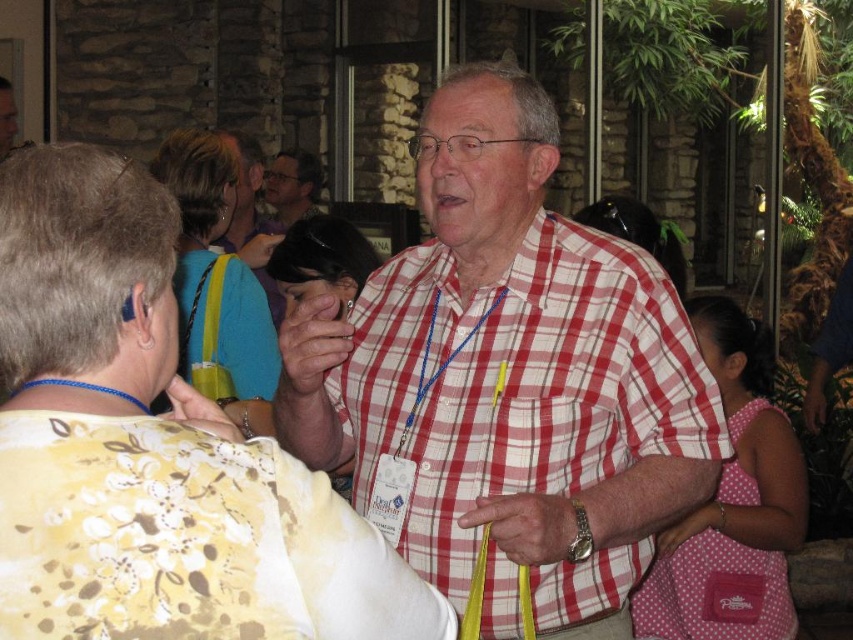
Question: Is red checkered shirt at center to the right of matte yellow lanyard at upper center from the viewer's perspective?

Choices:
 (A) no
 (B) yes

Answer: (B)

Question: Which of the following is the farthest from the observer?

Choices:
 (A) (265, 173)
 (B) (260, 236)

Answer: (A)

Question: Does red checkered shirt at center lie in front of matte black glasses at upper center?

Choices:
 (A) no
 (B) yes

Answer: (B)

Question: Can you confirm if red checkered shirt at center is positioned to the left of matte yellow lanyard at upper center?

Choices:
 (A) yes
 (B) no

Answer: (B)

Question: Which point appears farthest from the camera in this image?

Choices:
 (A) (300, 176)
 (B) (294, 397)
 (C) (277, 321)

Answer: (A)

Question: Estimate the real-world distances between objects in this image. Which object is farther from the matte black glasses at upper center?

Choices:
 (A) matte yellow lanyard at upper center
 (B) red checkered shirt at center

Answer: (B)